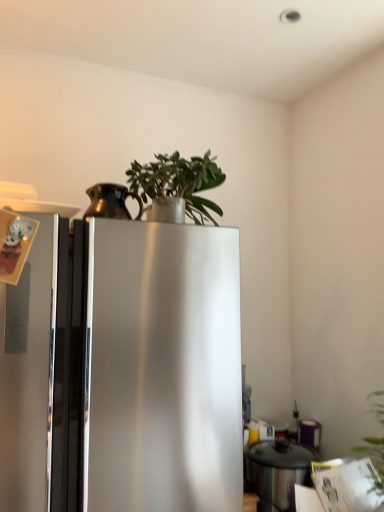
Question: Is bronze metallic pitcher at upper left, the second appliance in the back-to-front sequence, in front of stainless steel pot at lower right, the 1th appliance from the right?

Choices:
 (A) yes
 (B) no

Answer: (A)

Question: Can stainless steel pot at lower right, the first appliance viewed from the back, be found inside bronze metallic pitcher at upper left, the 1th appliance from the top?

Choices:
 (A) yes
 (B) no

Answer: (B)

Question: Is bronze metallic pitcher at upper left, acting as the second appliance starting from the bottom, outside stainless steel pot at lower right, the first appliance in the bottom-to-top sequence?

Choices:
 (A) no
 (B) yes

Answer: (B)

Question: Considering the relative positions of bronze metallic pitcher at upper left, the 1th appliance from the top, and stainless steel pot at lower right, the second appliance in the front-to-back sequence, in the image provided, is bronze metallic pitcher at upper left, the 1th appliance from the top, to the left of stainless steel pot at lower right, the second appliance in the front-to-back sequence, from the viewer's perspective?

Choices:
 (A) no
 (B) yes

Answer: (B)

Question: Is bronze metallic pitcher at upper left, marked as the first appliance in a left-to-right arrangement, positioned behind stainless steel pot at lower right, the first appliance in the bottom-to-top sequence?

Choices:
 (A) yes
 (B) no

Answer: (B)

Question: Can you confirm if bronze metallic pitcher at upper left, the 1th appliance in the front-to-back sequence, is bigger than stainless steel pot at lower right, positioned as the second appliance in top-to-bottom order?

Choices:
 (A) no
 (B) yes

Answer: (A)

Question: Could stainless steel pot at lower right, positioned as the second appliance in top-to-bottom order, be considered to be inside green matte plant at upper center?

Choices:
 (A) yes
 (B) no

Answer: (B)

Question: From the image's perspective, is green matte plant at upper center beneath stainless steel pot at lower right, the 2th appliance from the left?

Choices:
 (A) no
 (B) yes

Answer: (A)

Question: Can you confirm if green matte plant at upper center is thinner than stainless steel pot at lower right, the first appliance viewed from the back?

Choices:
 (A) no
 (B) yes

Answer: (A)

Question: Is green matte plant at upper center next to stainless steel pot at lower right, positioned as the second appliance in top-to-bottom order?

Choices:
 (A) yes
 (B) no

Answer: (B)

Question: Could you tell me if green matte plant at upper center is facing stainless steel pot at lower right, the 1th appliance from the right?

Choices:
 (A) no
 (B) yes

Answer: (A)

Question: Is green matte plant at upper center located outside stainless steel pot at lower right, the 2th appliance from the left?

Choices:
 (A) yes
 (B) no

Answer: (A)

Question: Can you confirm if bronze metallic pitcher at upper left, the 1th appliance in the front-to-back sequence, is smaller than green matte plant at upper center?

Choices:
 (A) no
 (B) yes

Answer: (B)